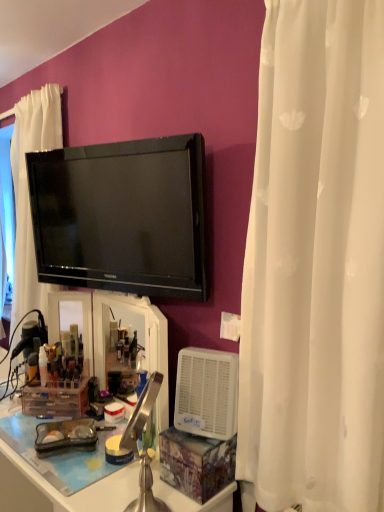
Where is `matte gold tube at left, the first toiletry viewed from the left`? The height and width of the screenshot is (512, 384). matte gold tube at left, the first toiletry viewed from the left is located at coordinates (33, 368).

What do you see at coordinates (207, 393) in the screenshot?
I see `white plastic air purifier at lower right` at bounding box center [207, 393].

Where is `white plastic desk at lower left`? The image size is (384, 512). white plastic desk at lower left is located at coordinates (58, 490).

Is black glossy tv at upper center located within white plastic air purifier at lower right?

No, white plastic air purifier at lower right does not contain black glossy tv at upper center.

Considering the sizes of white plastic air purifier at lower right and black glossy tv at upper center in the image, is white plastic air purifier at lower right taller or shorter than black glossy tv at upper center?

white plastic air purifier at lower right is shorter than black glossy tv at upper center.

Considering the positions of point (215, 359) and point (113, 233), is point (215, 359) closer or farther from the camera than point (113, 233)?

Point (215, 359) appears to be closer to the viewer than point (113, 233).

From a real-world perspective, which object stands above the other?

black glossy tv at upper center is physically above.

Considering their positions, is black glossy tv at upper center located in front of or behind translucent plastic container at lower left, which is counted as the second toiletry, starting from the left?

black glossy tv at upper center is in front of translucent plastic container at lower left, which is counted as the second toiletry, starting from the left.

Who is bigger, black glossy tv at upper center or translucent plastic container at lower left, which is counted as the second toiletry, starting from the left?

black glossy tv at upper center is bigger.

Is black glossy tv at upper center taller or shorter than translucent plastic container at lower left, which is the first toiletry from right to left?

black glossy tv at upper center is taller than translucent plastic container at lower left, which is the first toiletry from right to left.

Considering the positions of objects black glossy tv at upper center and translucent plastic container at lower left, which is the first toiletry from right to left, in the image provided, who is more to the left, black glossy tv at upper center or translucent plastic container at lower left, which is the first toiletry from right to left,?

Positioned to the left is translucent plastic container at lower left, which is the first toiletry from right to left.

Between white sheer curtain at right and white plastic air purifier at lower right, which one has smaller width?

Thinner between the two is white plastic air purifier at lower right.

From a real-world perspective, between white sheer curtain at right and white plastic air purifier at lower right, who is vertically higher?

white sheer curtain at right is physically above.

Is white sheer curtain at right smaller than white plastic air purifier at lower right?

Incorrect, white sheer curtain at right is not smaller in size than white plastic air purifier at lower right.

Could you measure the distance between white sheer curtain at right and translucent plastic container at lower left, which is the first toiletry from right to left?

white sheer curtain at right and translucent plastic container at lower left, which is the first toiletry from right to left, are 1.15 meters apart from each other.

Can we say white sheer curtain at right lies outside translucent plastic container at lower left, which is counted as the second toiletry, starting from the left?

Yes, white sheer curtain at right is not within translucent plastic container at lower left, which is counted as the second toiletry, starting from the left.

In terms of width, does white sheer curtain at right look wider or thinner when compared to translucent plastic container at lower left, which is counted as the second toiletry, starting from the left?

white sheer curtain at right is wider than translucent plastic container at lower left, which is counted as the second toiletry, starting from the left.

Where is `curtain positioned vertically above the translucent plastic container at lower left, which is counted as the second toiletry, starting from the left (from a real-world perspective)`? curtain positioned vertically above the translucent plastic container at lower left, which is counted as the second toiletry, starting from the left (from a real-world perspective) is located at coordinates (316, 262).

Between point (37, 367) and point (48, 484), which one is positioned in front?

Positioned in front is point (48, 484).

Is matte gold tube at left, the first toiletry viewed from the left, next to white plastic desk at lower left?

No, matte gold tube at left, the first toiletry viewed from the left, is not beside white plastic desk at lower left.

Does matte gold tube at left, the first toiletry viewed from the left, appear on the right side of white plastic desk at lower left?

Incorrect, matte gold tube at left, the first toiletry viewed from the left, is not on the right side of white plastic desk at lower left.

From their relative heights in the image, would you say matte gold tube at left, the first toiletry viewed from the left, is taller or shorter than white plastic desk at lower left?

matte gold tube at left, the first toiletry viewed from the left, is shorter than white plastic desk at lower left.

From the picture: Looking at their sizes, would you say translucent plastic container at lower left, which is the first toiletry from right to left, is wider or thinner than black glossy tv at upper center?

In the image, translucent plastic container at lower left, which is the first toiletry from right to left, appears to be more narrow than black glossy tv at upper center.

How many degrees apart are the facing directions of translucent plastic container at lower left, which is counted as the second toiletry, starting from the left, and black glossy tv at upper center?

The angular difference between translucent plastic container at lower left, which is counted as the second toiletry, starting from the left, and black glossy tv at upper center is 22.9 degrees.

Considering the relative positions of translucent plastic container at lower left, which is counted as the second toiletry, starting from the left, and black glossy tv at upper center in the image provided, is translucent plastic container at lower left, which is counted as the second toiletry, starting from the left, to the left or to the right of black glossy tv at upper center?

translucent plastic container at lower left, which is counted as the second toiletry, starting from the left, is positioned on black glossy tv at upper center's left side.

Does point (1, 450) come closer to viewer compared to point (45, 374)?

That is True.

Can you confirm if white plastic desk at lower left is positioned to the left of translucent plastic container at lower left, which is counted as the second toiletry, starting from the left?

In fact, white plastic desk at lower left is to the right of translucent plastic container at lower left, which is counted as the second toiletry, starting from the left.

Between white plastic desk at lower left and translucent plastic container at lower left, which is the first toiletry from right to left, which one has smaller size?

translucent plastic container at lower left, which is the first toiletry from right to left, is smaller.

From the picture: From the image's perspective, which one is positioned higher, white plastic desk at lower left or translucent plastic container at lower left, which is counted as the second toiletry, starting from the left?

From the image's view, translucent plastic container at lower left, which is counted as the second toiletry, starting from the left, is above.

Where is `appliance in front of the black glossy tv at upper center`? The width and height of the screenshot is (384, 512). appliance in front of the black glossy tv at upper center is located at coordinates (207, 393).

The width and height of the screenshot is (384, 512). I want to click on television lying on the right of translucent plastic container at lower left, which is the first toiletry from right to left, so click(x=122, y=216).

Estimate the real-world distances between objects in this image. Which object is further from white sheer curtain at right, matte gold tube at left, the first toiletry viewed from the left, or black glossy tv at upper center?

matte gold tube at left, the first toiletry viewed from the left.

Considering their positions, is white plastic desk at lower left positioned further to matte gold tube at left, the first toiletry viewed from the left, than white sheer curtain at right?

white sheer curtain at right is positioned further to the anchor matte gold tube at left, the first toiletry viewed from the left.

Estimate the real-world distances between objects in this image. Which object is further from translucent plastic container at lower left, which is the first toiletry from right to left, white plastic desk at lower left or white sheer curtain at right?

Among the two, white sheer curtain at right is located further to translucent plastic container at lower left, which is the first toiletry from right to left.

Looking at the image, which one is located further to translucent plastic container at lower left, which is the first toiletry from right to left, white sheer curtain at right or white plastic desk at lower left?

white sheer curtain at right is positioned further to the anchor translucent plastic container at lower left, which is the first toiletry from right to left.

Based on their spatial positions, is white plastic air purifier at lower right or white plastic desk at lower left closer to black glossy tv at upper center?

white plastic air purifier at lower right lies closer to black glossy tv at upper center than the other object.

Considering their positions, is matte gold tube at left, the first toiletry viewed from the left, positioned further to white plastic air purifier at lower right than white plastic desk at lower left?

matte gold tube at left, the first toiletry viewed from the left.

From the image, which object appears to be farther from matte gold tube at left, the first toiletry viewed from the left, translucent plastic container at lower left, which is counted as the second toiletry, starting from the left, or white plastic air purifier at lower right?

white plastic air purifier at lower right lies further to matte gold tube at left, the first toiletry viewed from the left, than the other object.

When comparing their distances from white sheer curtain at right, does white plastic air purifier at lower right or black glossy tv at upper center seem closer?

white plastic air purifier at lower right is positioned closer to the anchor white sheer curtain at right.

Find the location of a particular element. The image size is (384, 512). toiletry between white plastic desk at lower left and translucent plastic container at lower left, which is the first toiletry from right to left, in the front-back direction is located at coordinates point(33,368).

Identify the location of appliance situated between matte gold tube at left, the first toiletry viewed from the left, and white sheer curtain at right from left to right. (207, 393).

What are the coordinates of `curtain that lies between black glossy tv at upper center and white plastic desk at lower left from top to bottom` in the screenshot? It's located at (316, 262).

Image resolution: width=384 pixels, height=512 pixels. I want to click on appliance between black glossy tv at upper center and white plastic desk at lower left from top to bottom, so click(x=207, y=393).